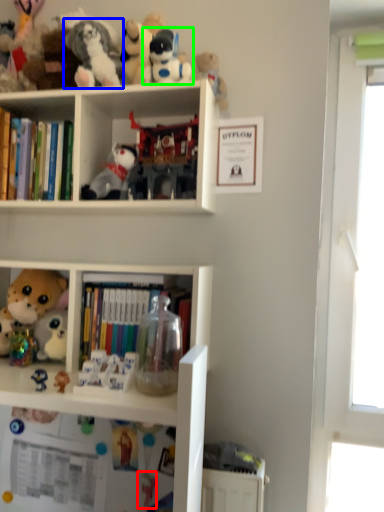
Question: Which object is positioned farthest from toy (highlighted by a red box)? Select from toy (highlighted by a blue box) and toy (highlighted by a green box).

Choices:
 (A) toy
 (B) toy

Answer: (B)